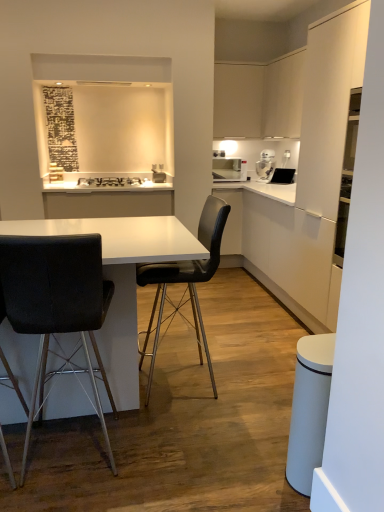
At what (x,y) coordinates should I click in order to perform the action: click on spots to the right of black leather chair at center, arranged as the first chair when viewed from the right. Please return your answer as a coordinate pair (x, y). The image size is (384, 512). Looking at the image, I should click on (259, 381).